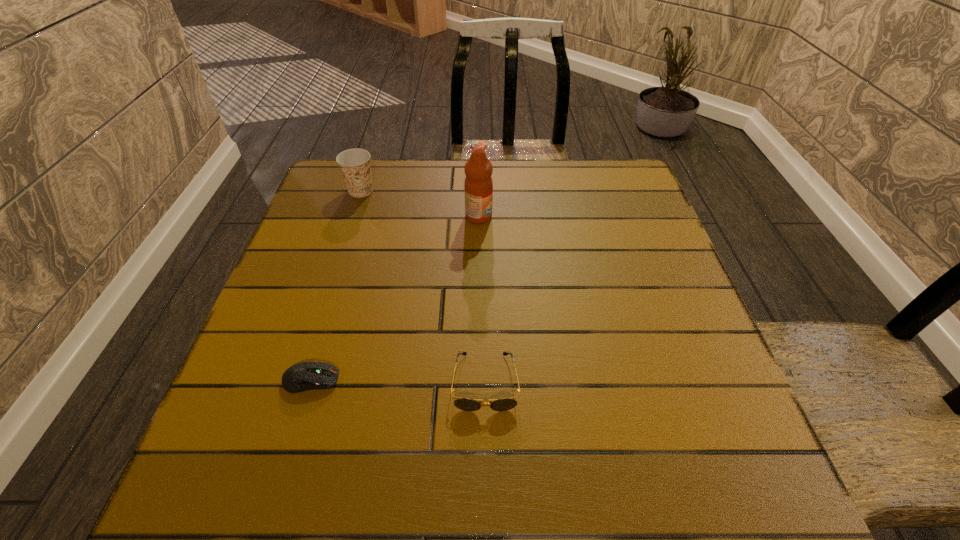
The width and height of the screenshot is (960, 540). Find the location of `fruit juice that is at the far edge`. fruit juice that is at the far edge is located at coordinates (478, 185).

What are the coordinates of `Dixie cup situated at the far edge` in the screenshot? It's located at (355, 166).

You are a GUI agent. You are given a task and a screenshot of the screen. Output one action in this format:
    pyautogui.click(x=<x>, y=<y>)
    Task: Click on the Dixie cup present at the left edge
    Image resolution: width=960 pixels, height=540 pixels.
    Given the screenshot: What is the action you would take?
    pyautogui.click(x=355, y=166)

The width and height of the screenshot is (960, 540). I want to click on computer equipment located in the left edge section of the desktop, so click(303, 376).

Find the location of a particular element. The width and height of the screenshot is (960, 540). object positioned at the far left corner is located at coordinates (355, 166).

In order to click on vacant space at the far edge in this screenshot , I will do `click(444, 189)`.

The height and width of the screenshot is (540, 960). I want to click on vacant space at the near edge of the desktop, so click(484, 458).

This screenshot has width=960, height=540. I want to click on vacant space at the left edge of the desktop, so click(x=315, y=276).

The image size is (960, 540). What are the coordinates of `vacant space at the right edge of the desktop` in the screenshot? It's located at (733, 403).

Find the location of a particular element. The image size is (960, 540). blank space at the far right corner of the desktop is located at coordinates (594, 205).